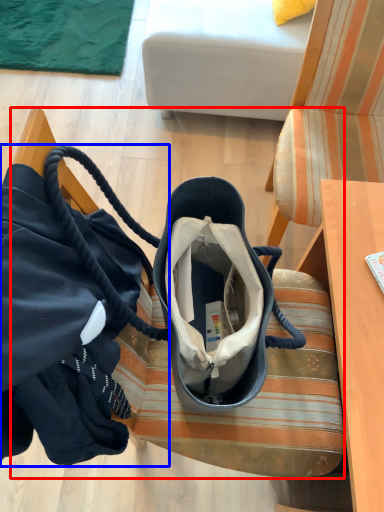
Question: Which point is further to the camera, furniture (highlighted by a red box) or handbag (highlighted by a blue box)?

Choices:
 (A) furniture
 (B) handbag

Answer: (A)